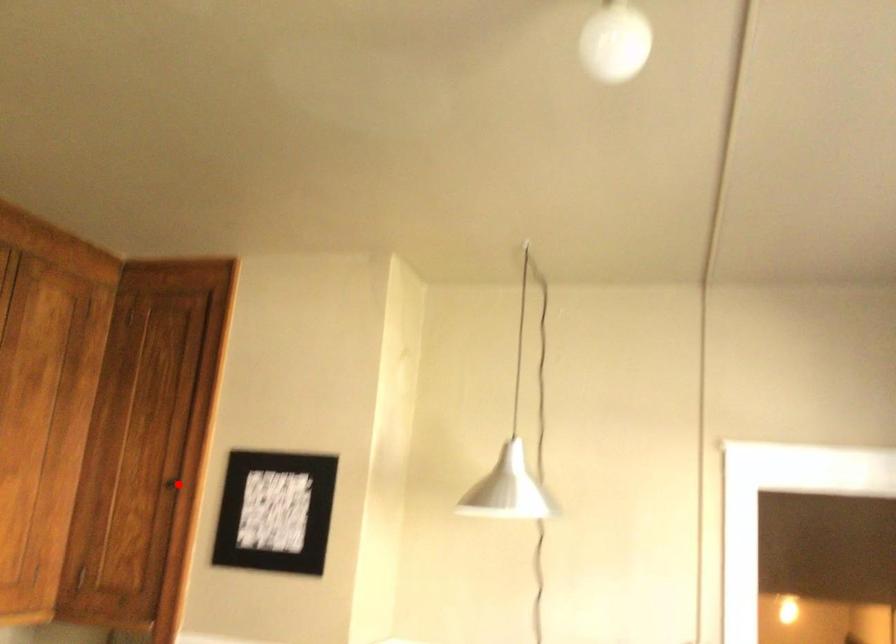
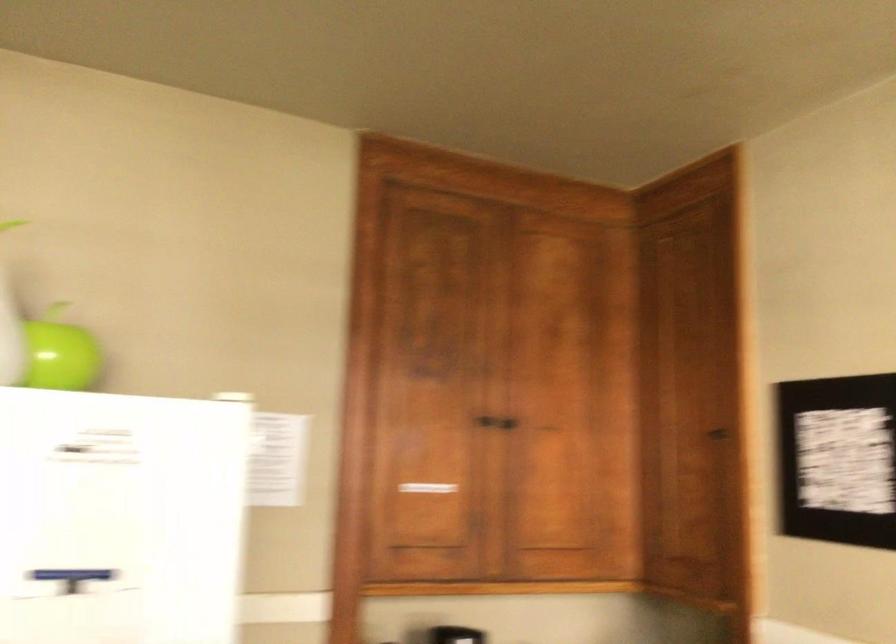
Question: I am providing you with two images of the same scene from different viewpoints. In image1, a red point is highlighted. Considering the same 3D point in image2, which of the following is correct?

Choices:
 (A) It is closer
 (B) It is farther

Answer: (A)